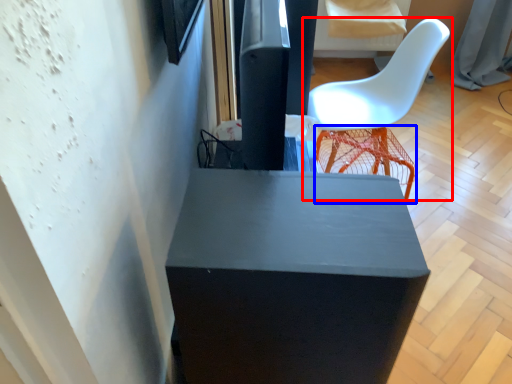
Question: Among these objects, which one is nearest to the camera, chair (highlighted by a red box) or bar stool (highlighted by a blue box)?

Choices:
 (A) chair
 (B) bar stool

Answer: (A)